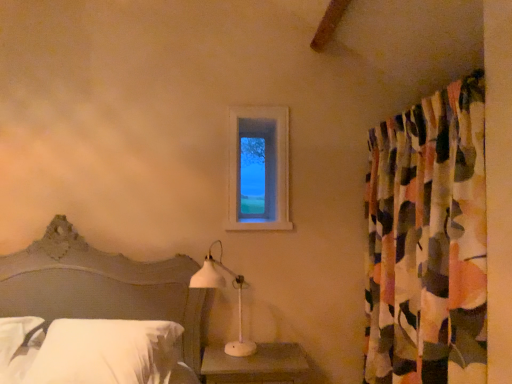
The height and width of the screenshot is (384, 512). Identify the location of white plastic table lamp at lower center. (224, 287).

The height and width of the screenshot is (384, 512). Identify the location of matte gray headboard at lower left. (102, 287).

Locate an element on the screen. clear glass window at upper center is located at coordinates (258, 169).

Find the location of `white plastic table lamp at lower center`. white plastic table lamp at lower center is located at coordinates (224, 287).

Is multicolored fabric curtain at right oriented away from clear glass window at upper center?

No, multicolored fabric curtain at right is not facing away from clear glass window at upper center.

Looking at this image, does multicolored fabric curtain at right touch clear glass window at upper center?

No, multicolored fabric curtain at right is not next to clear glass window at upper center.

Considering the sizes of objects multicolored fabric curtain at right and clear glass window at upper center in the image provided, who is bigger, multicolored fabric curtain at right or clear glass window at upper center?

With larger size is multicolored fabric curtain at right.

From the image's perspective, who appears lower, multicolored fabric curtain at right or clear glass window at upper center?

multicolored fabric curtain at right is shown below in the image.

Could matte white wood nightstand at lower center be considered to be inside multicolored fabric curtain at right?

Actually, matte white wood nightstand at lower center is outside multicolored fabric curtain at right.

Is multicolored fabric curtain at right further to the viewer compared to matte white wood nightstand at lower center?

No, multicolored fabric curtain at right is closer to the viewer.

Which is closer, [437,375] or [219,347]?

The point [437,375] is closer.

From the image's perspective, is multicolored fabric curtain at right located above matte white wood nightstand at lower center?

Yes.

Considering the relative sizes of multicolored fabric curtain at right and white soft pillow at lower left in the image provided, is multicolored fabric curtain at right shorter than white soft pillow at lower left?

No, multicolored fabric curtain at right is not shorter than white soft pillow at lower left.

Considering the relative sizes of multicolored fabric curtain at right and white soft pillow at lower left in the image provided, is multicolored fabric curtain at right wider than white soft pillow at lower left?

No.

Is multicolored fabric curtain at right far from white soft pillow at lower left?

That's right, there is a large distance between multicolored fabric curtain at right and white soft pillow at lower left.

Is white soft pillow at lower left completely or partially inside multicolored fabric curtain at right?

Actually, white soft pillow at lower left is outside multicolored fabric curtain at right.

Which object is thinner, white soft pillow at lower left or matte white wood nightstand at lower center?

Thinner between the two is matte white wood nightstand at lower center.

From a real-world perspective, is white soft pillow at lower left over matte white wood nightstand at lower center?

Correct, in the physical world, white soft pillow at lower left is higher than matte white wood nightstand at lower center.

Could you tell me if white soft pillow at lower left is turned towards matte white wood nightstand at lower center?

No, white soft pillow at lower left is not oriented towards matte white wood nightstand at lower center.

Image resolution: width=512 pixels, height=384 pixels. I want to click on nightstand directly beneath the white soft pillow at lower left (from a real-world perspective), so click(x=257, y=365).

Is white plastic table lamp at lower center at the back of matte gray headboard at lower left?

No, matte gray headboard at lower left is not facing the opposite direction of white plastic table lamp at lower center.

From the image's perspective, would you say matte gray headboard at lower left is shown under white plastic table lamp at lower center?

Correct, matte gray headboard at lower left appears lower than white plastic table lamp at lower center in the image.

Considering the sizes of objects matte gray headboard at lower left and white plastic table lamp at lower center in the image provided, who is smaller, matte gray headboard at lower left or white plastic table lamp at lower center?

With smaller size is white plastic table lamp at lower center.

Is matte gray headboard at lower left touching white plastic table lamp at lower center?

No, matte gray headboard at lower left is not next to white plastic table lamp at lower center.

Can we say multicolored fabric curtain at right lies outside matte gray headboard at lower left?

multicolored fabric curtain at right lies outside matte gray headboard at lower left's area.

This screenshot has height=384, width=512. I want to click on curtain above the matte gray headboard at lower left (from a real-world perspective), so click(x=428, y=241).

What's the angular difference between multicolored fabric curtain at right and matte gray headboard at lower left's facing directions?

multicolored fabric curtain at right and matte gray headboard at lower left are facing 87.3 degrees away from each other.

Based on the photo, between white soft pillow at lower left and matte gray headboard at lower left, which one has larger size?

matte gray headboard at lower left.

Is matte gray headboard at lower left surrounded by white soft pillow at lower left?

Actually, matte gray headboard at lower left is outside white soft pillow at lower left.

Which of these two, white soft pillow at lower left or matte gray headboard at lower left, stands taller?

Standing taller between the two is matte gray headboard at lower left.

Find the location of `window on the left of multicolored fabric curtain at right`. window on the left of multicolored fabric curtain at right is located at coordinates (258, 169).

The image size is (512, 384). I want to click on curtain located above the matte white wood nightstand at lower center (from the image's perspective), so click(428, 241).

Estimate the real-world distances between objects in this image. Which object is closer to clear glass window at upper center, matte white wood nightstand at lower center or matte gray headboard at lower left?

Based on the image, matte gray headboard at lower left appears to be nearer to clear glass window at upper center.

Based on their spatial positions, is white plastic table lamp at lower center or multicolored fabric curtain at right closer to matte gray headboard at lower left?

Among the two, white plastic table lamp at lower center is located nearer to matte gray headboard at lower left.

Which object lies further to the anchor point white plastic table lamp at lower center, multicolored fabric curtain at right or white soft pillow at lower left?

multicolored fabric curtain at right is positioned further to the anchor white plastic table lamp at lower center.

From the image, which object appears to be nearer to matte gray headboard at lower left, matte white wood nightstand at lower center or clear glass window at upper center?

Based on the image, matte white wood nightstand at lower center appears to be nearer to matte gray headboard at lower left.

Estimate the real-world distances between objects in this image. Which object is further from white soft pillow at lower left, matte gray headboard at lower left or white plastic table lamp at lower center?

white plastic table lamp at lower center lies further to white soft pillow at lower left than the other object.

When comparing their distances from matte gray headboard at lower left, does clear glass window at upper center or white soft pillow at lower left seem further?

The object further to matte gray headboard at lower left is clear glass window at upper center.

Considering their positions, is matte gray headboard at lower left positioned further to multicolored fabric curtain at right than clear glass window at upper center?

matte gray headboard at lower left.

Looking at this image, estimate the real-world distances between objects in this image. Which object is further from white plastic table lamp at lower center, matte gray headboard at lower left or matte white wood nightstand at lower center?

The object further to white plastic table lamp at lower center is matte gray headboard at lower left.

I want to click on nightstand positioned between multicolored fabric curtain at right and clear glass window at upper center from near to far, so click(257, 365).

The width and height of the screenshot is (512, 384). I want to click on curtain between matte gray headboard at lower left and white plastic table lamp at lower center from front to back, so click(428, 241).

Locate an element on the screen. Image resolution: width=512 pixels, height=384 pixels. table lamp between matte gray headboard at lower left and matte white wood nightstand at lower center along the z-axis is located at coordinates (224, 287).

Where is `table lamp situated between white soft pillow at lower left and multicolored fabric curtain at right from left to right`? table lamp situated between white soft pillow at lower left and multicolored fabric curtain at right from left to right is located at coordinates (224, 287).